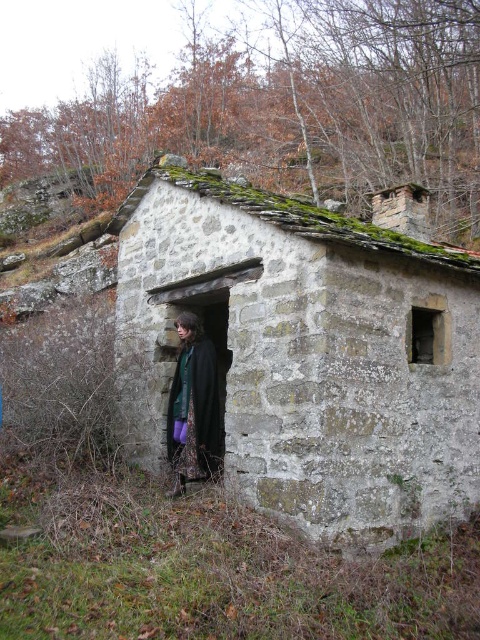
Question: Among these points, which one is farthest from the camera?

Choices:
 (A) (359, 547)
 (B) (210, 380)

Answer: (B)

Question: Observing the image, what is the correct spatial positioning of stone textured hut at center in reference to black woolen coat at center?

Choices:
 (A) below
 (B) above

Answer: (B)

Question: Which of the following is the closest to the observer?

Choices:
 (A) stone textured hut at center
 (B) black woolen coat at center

Answer: (A)

Question: Does stone textured hut at center have a lesser width compared to black woolen coat at center?

Choices:
 (A) yes
 (B) no

Answer: (B)

Question: Does stone textured hut at center have a larger size compared to black woolen coat at center?

Choices:
 (A) no
 (B) yes

Answer: (B)